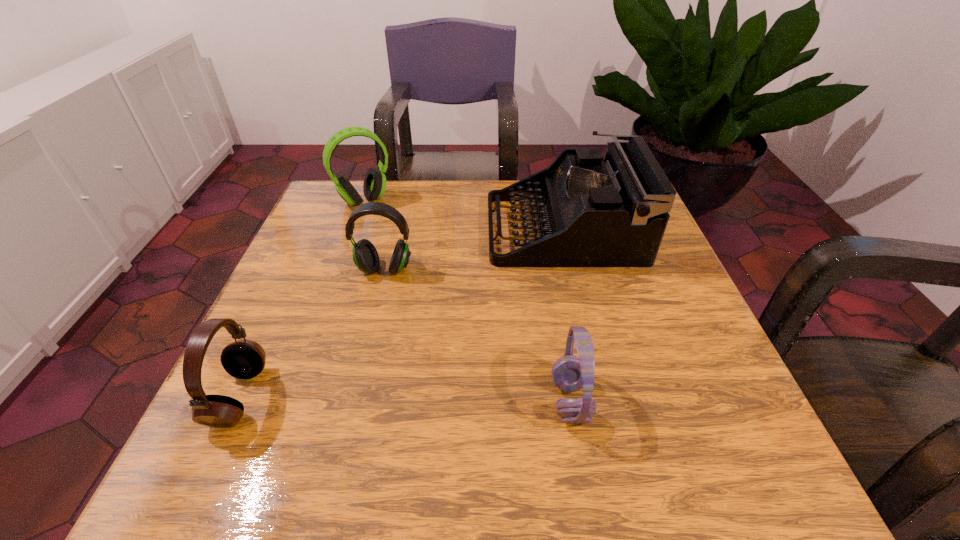
Locate an element on the screen. free point between the tallest headset and the second farthest headset is located at coordinates (374, 235).

Identify the location of vacant space that is in between the rightmost headset and the typewriter. Image resolution: width=960 pixels, height=540 pixels. (566, 315).

I want to click on object that is the third closest to the farthest headset, so click(x=244, y=359).

Where is `the fourth closest object to the typewriter`? the fourth closest object to the typewriter is located at coordinates (244, 359).

The width and height of the screenshot is (960, 540). Find the location of `headset that stands as the second closest to the second farthest headset`. headset that stands as the second closest to the second farthest headset is located at coordinates (244, 359).

The height and width of the screenshot is (540, 960). I want to click on headset that is the nearest to the tallest headset, so click(365, 256).

In order to click on vacant area that satisfies the following two spatial constraints: 1. on the typing side of the typewriter; 2. on the ear cups of the third nearest headset in this screenshot , I will do `click(573, 269)`.